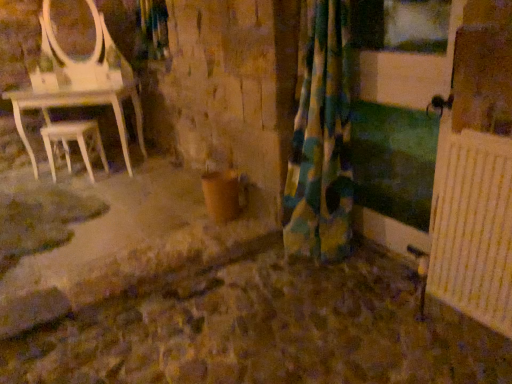
Question: From a real-world perspective, is fluffy multicolored curtain at center physically located above or below white wood stool at left?

Choices:
 (A) below
 (B) above

Answer: (B)

Question: Looking at the image, does fluffy multicolored curtain at center seem bigger or smaller compared to white wood stool at left?

Choices:
 (A) small
 (B) big

Answer: (B)

Question: From the image's perspective, is fluffy multicolored curtain at center positioned above or below white wood stool at left?

Choices:
 (A) above
 (B) below

Answer: (B)

Question: Considering the positions of white wood stool at left and fluffy multicolored curtain at center in the image, is white wood stool at left wider or thinner than fluffy multicolored curtain at center?

Choices:
 (A) wide
 (B) thin

Answer: (B)

Question: Is white wood stool at left spatially inside fluffy multicolored curtain at center, or outside of it?

Choices:
 (A) inside
 (B) outside

Answer: (B)

Question: From their relative heights in the image, would you say white wood stool at left is taller or shorter than fluffy multicolored curtain at center?

Choices:
 (A) short
 (B) tall

Answer: (A)

Question: From a real-world perspective, is white wood stool at left positioned above or below fluffy multicolored curtain at center?

Choices:
 (A) above
 (B) below

Answer: (B)